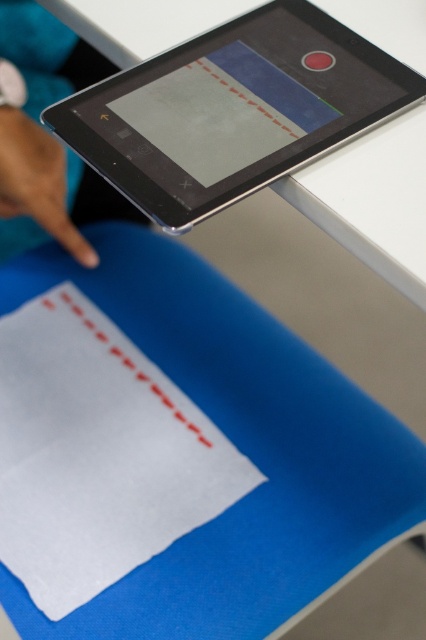
Question: Which object appears farthest from the camera in this image?

Choices:
 (A) matte black tablet at upper center
 (B) white matte paper at lower left

Answer: (B)

Question: Is white matte paper at lower left smaller than matte black tablet at upper center?

Choices:
 (A) no
 (B) yes

Answer: (A)

Question: Which point is farther to the camera?

Choices:
 (A) (226, 163)
 (B) (192, 483)

Answer: (B)

Question: Is white matte paper at lower left to the left of matte black tablet at upper center from the viewer's perspective?

Choices:
 (A) yes
 (B) no

Answer: (A)

Question: Can you confirm if matte black tablet at upper center is smaller than matte skin hand at upper left?

Choices:
 (A) no
 (B) yes

Answer: (A)

Question: Which of the following is the closest to the observer?

Choices:
 (A) (166, 381)
 (B) (218, 116)

Answer: (B)